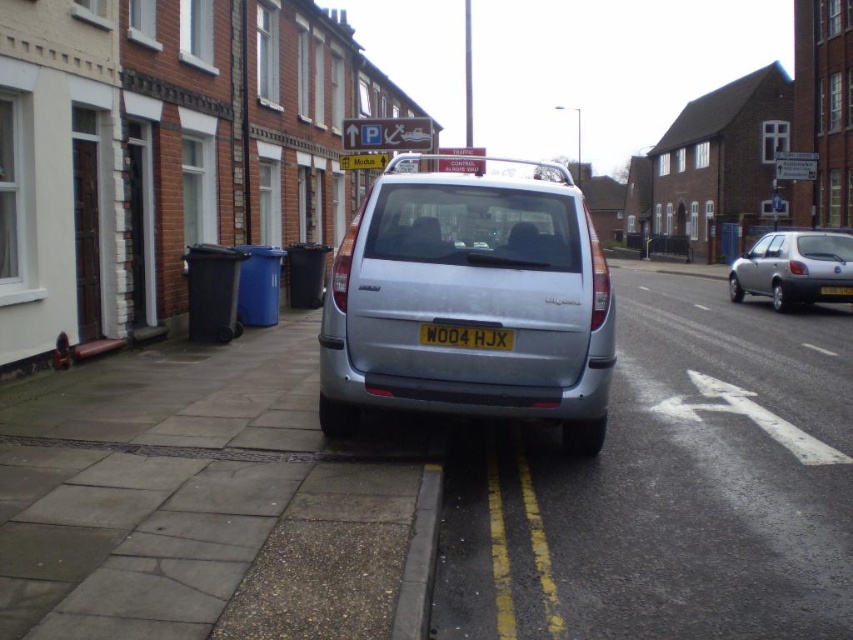
You are a delivery driver who needs to park your vehicle in this area. You see the silver metallic hatchback at right and the white plastic license plate at center. According to the scene, is the license plate positioned in front of or behind the car?

The white plastic license plate at center is behind the silver metallic hatchback at right, so it is positioned behind the car.

You are standing on the sidewalk and want to approach the silver car parked on the right side of the street. The point you are currently at is point (444,353). Can you safely walk towards the car without crossing the double yellow lines?

The point (444,353) is 4.97 meters from viewer. Since the car is parked on the right side of the street and the double yellow lines are in the center, you can safely walk towards the car as long as you stay on the sidewalk and do not cross the double yellow lines.

Consider the image. You are standing on the sidewalk and want to cross the street to reach the silver metallic minivan at center. Given that the minivan is 15.69 feet away, is it within a safe distance for a quick walk? Please explain.

The silver metallic minivan at center is 15.69 feet away from you. Since this distance is relatively short, it would be safe to quickly walk to the minivan as long as you ensure traffic conditions are clear and follow pedestrian safety guidelines.